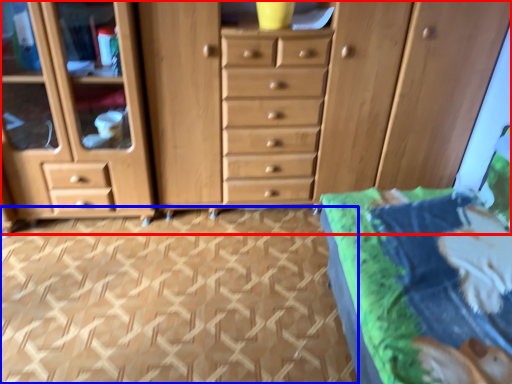
Question: Which object is closer to the camera taking this photo, chest of drawers (highlighted by a red box) or tile (highlighted by a blue box)?

Choices:
 (A) chest of drawers
 (B) tile

Answer: (B)